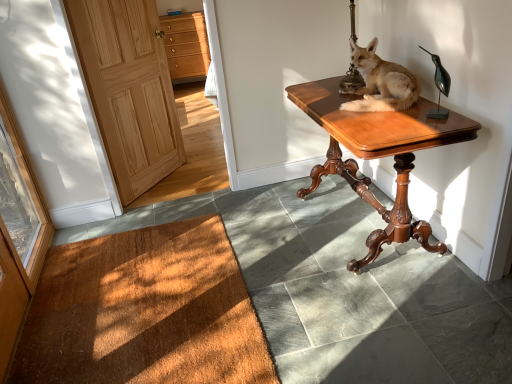
What are the coordinates of `free space between mahogany wood desk at center and brown textured mat at lower left` in the screenshot? It's located at (303, 272).